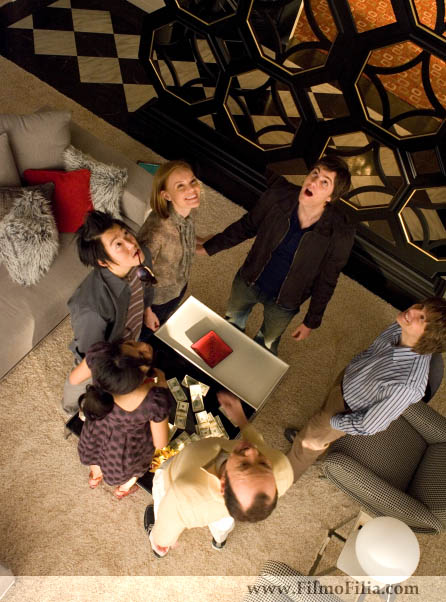
Locate an element on the screen. The image size is (446, 602). lamp is located at coordinates (383, 540).